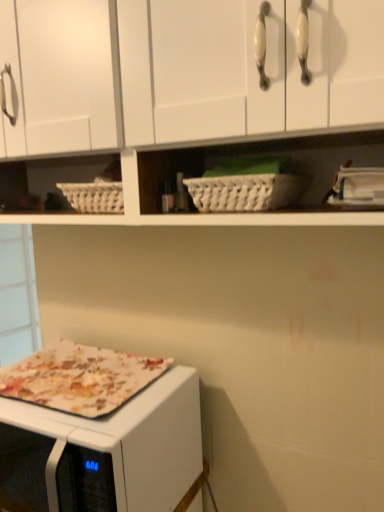
Question: From a real-world perspective, is floral fabric microwave oven at lower left on top of white wicker basket at center?

Choices:
 (A) no
 (B) yes

Answer: (A)

Question: From a real-world perspective, is floral fabric microwave oven at lower left located beneath white wicker basket at center?

Choices:
 (A) yes
 (B) no

Answer: (A)

Question: Is floral fabric microwave oven at lower left outside of white wicker basket at center?

Choices:
 (A) yes
 (B) no

Answer: (A)

Question: Does floral fabric microwave oven at lower left appear on the right side of white wicker basket at center?

Choices:
 (A) yes
 (B) no

Answer: (B)

Question: Is floral fabric microwave oven at lower left thinner than white wicker basket at center?

Choices:
 (A) yes
 (B) no

Answer: (B)

Question: Is floral fabric microwave oven at lower left looking in the opposite direction of white wicker basket at center?

Choices:
 (A) no
 (B) yes

Answer: (A)

Question: From the image's perspective, is white matte cabinet at upper center located above white wicker basket at center?

Choices:
 (A) no
 (B) yes

Answer: (B)

Question: From a real-world perspective, is white matte cabinet at upper center on white wicker basket at center?

Choices:
 (A) yes
 (B) no

Answer: (A)

Question: Does white matte cabinet at upper center have a greater width compared to white wicker basket at center?

Choices:
 (A) yes
 (B) no

Answer: (A)

Question: Is white matte cabinet at upper center thinner than white wicker basket at center?

Choices:
 (A) no
 (B) yes

Answer: (A)

Question: Would you say white matte cabinet at upper center is outside white wicker basket at center?

Choices:
 (A) no
 (B) yes

Answer: (B)

Question: Is white matte cabinet at upper center facing away from white wicker basket at center?

Choices:
 (A) yes
 (B) no

Answer: (A)

Question: From the image's perspective, does white matte cabinet at upper center appear lower than floral fabric microwave oven at lower left?

Choices:
 (A) yes
 (B) no

Answer: (B)